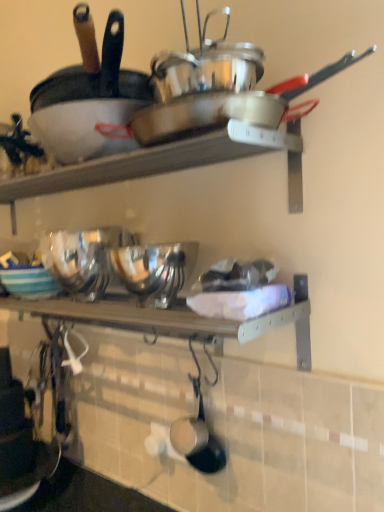
Question: Is matte black frying pan at upper left, the 1th frying pan from the top, spatially inside striped ceramic bowl at center, or outside of it?

Choices:
 (A) outside
 (B) inside

Answer: (A)

Question: In terms of size, does matte black frying pan at upper left, arranged as the 2th frying pan when ordered from the bottom, appear bigger or smaller than striped ceramic bowl at center?

Choices:
 (A) small
 (B) big

Answer: (B)

Question: Which object is positioned closest to the shiny silver wok at upper center?

Choices:
 (A) striped ceramic bowl at center
 (B) shiny silver frying pan at lower center, placed as the 2th frying pan when sorted from top to bottom
 (C) matte black frying pan at upper left, the 1th frying pan from the top
 (D) wooden shelf at center

Answer: (C)

Question: Which of these objects is positioned closest to the shiny silver frying pan at lower center, the 1th frying pan ordered from the bottom?

Choices:
 (A) shiny silver wok at upper center
 (B) matte black frying pan at upper left, arranged as the 2th frying pan when ordered from the bottom
 (C) wooden shelf at center
 (D) striped ceramic bowl at center

Answer: (C)